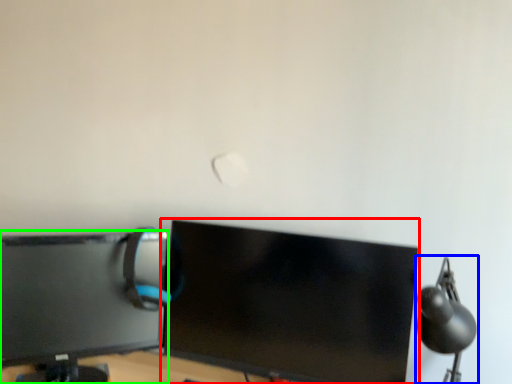
Question: Considering the real-world distances, which object is farthest from computer monitor (highlighted by a red box)? table lamp (highlighted by a blue box) or computer monitor (highlighted by a green box)?

Choices:
 (A) table lamp
 (B) computer monitor

Answer: (A)